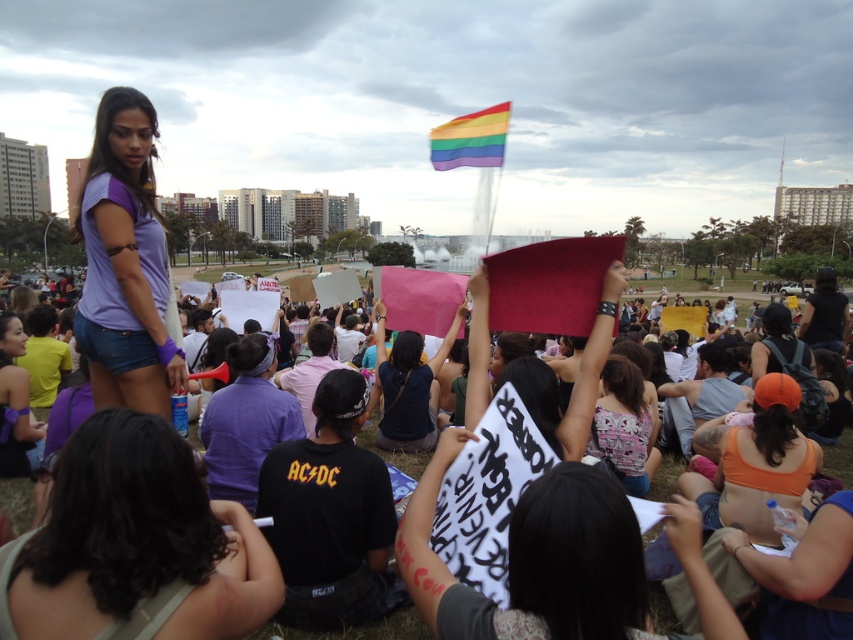
You are a photographer trying to capture a clear shot of both the matte purple shirt at center and the pink floral tank top at center. Since you want both subjects to be in focus, you need to adjust your camera settings. Which subject should you focus on to ensure both are sharp?

You should focus on the matte purple shirt at center because it is closer to the viewer than the pink floral tank top at center, so focusing on the closer subject will maximize the depth of field and keep both in focus.

You are a photographer taking pictures of the protest. You notice the purple matte shirt at upper left and the rainbow fabric flag at upper center. Which object is positioned to the left of the other?

The purple matte shirt at upper left is positioned to the left of the rainbow fabric flag at upper center.